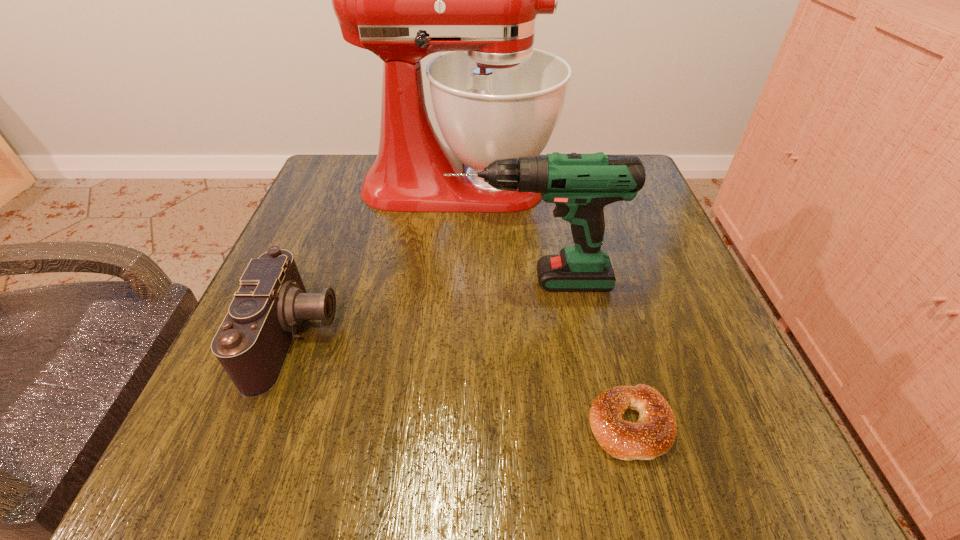
Where is `free space between the camera and the shortest object`? free space between the camera and the shortest object is located at coordinates (463, 381).

Locate an element on the screen. This screenshot has width=960, height=540. free spot between the third tallest object and the shortest object is located at coordinates [x=463, y=381].

Locate an element on the screen. This screenshot has height=540, width=960. unoccupied area between the farthest object and the camera is located at coordinates (377, 261).

The image size is (960, 540). I want to click on free space between the bagel and the tallest object, so click(544, 305).

I want to click on empty space that is in between the bagel and the drill, so click(581, 353).

Identify which object is the second nearest to the shortest object. Please provide its 2D coordinates. Your answer should be formatted as a tuple, i.e. [(x, y)], where the tuple contains the x and y coordinates of a point satisfying the conditions above.

[(252, 343)]

Select which object is the second closest to the camera. Please provide its 2D coordinates. Your answer should be formatted as a tuple, i.e. [(x, y)], where the tuple contains the x and y coordinates of a point satisfying the conditions above.

[(494, 96)]

Where is `free space that satisfies the following two spatial constraints: 1. on the back side of the bagel; 2. on the front-facing side of the third tallest object`? Image resolution: width=960 pixels, height=540 pixels. free space that satisfies the following two spatial constraints: 1. on the back side of the bagel; 2. on the front-facing side of the third tallest object is located at coordinates (607, 337).

Locate an element on the screen. This screenshot has width=960, height=540. free space that satisfies the following two spatial constraints: 1. at the attachment hub of the tallest object; 2. on the back side of the shortest object is located at coordinates (444, 424).

Locate an element on the screen. Image resolution: width=960 pixels, height=540 pixels. free location that satisfies the following two spatial constraints: 1. on the handle side of the drill; 2. on the right side of the bagel is located at coordinates (548, 424).